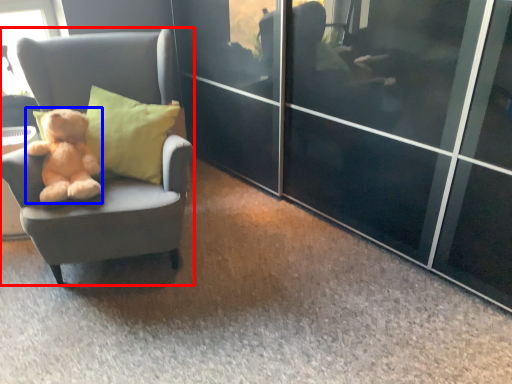
Question: Among these objects, which one is nearest to the camera, chair (highlighted by a red box) or teddy bear (highlighted by a blue box)?

Choices:
 (A) chair
 (B) teddy bear

Answer: (A)